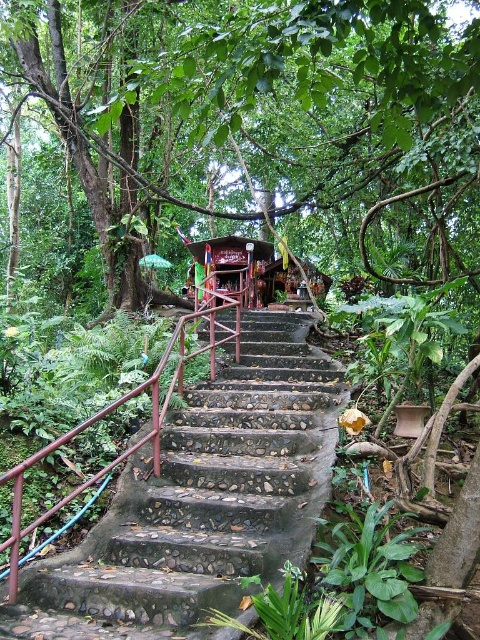
You are standing at the bottom of the rustic stone stairs at center and want to reach the green leafy tree at center. Which direction should you move towards?

The green leafy tree at center is bigger than rustic stone stairs at center, so you should move upwards along the rustic stone stairs at center to reach the green leafy tree at center located at the top.

You are standing at the bottom of the staircase and want to take a photo of the green leafy tree at center. Which direction should you face to ensure the tree is centered in your camera view?

The green leafy tree at center is located at point coordinates (260,120), so you should face towards the center area slightly to the left and lower middle to center it in your camera view.